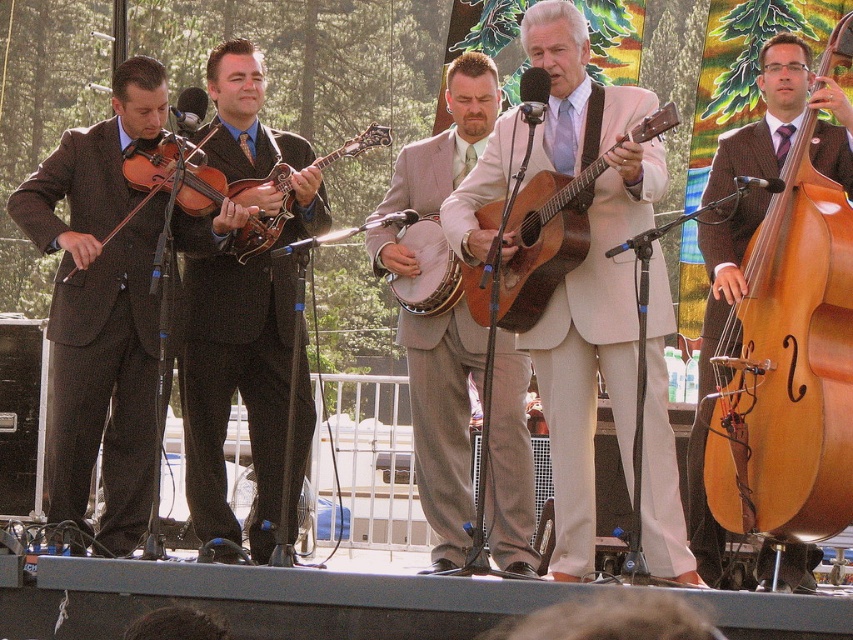
Question: Does light gray suit at center have a larger size compared to brown matte acoustic guitar at center?

Choices:
 (A) yes
 (B) no

Answer: (A)

Question: Is matte brown violin at left to the right of matte brown mandolin at center from the viewer's perspective?

Choices:
 (A) yes
 (B) no

Answer: (B)

Question: Which point is closer to the camera taking this photo?

Choices:
 (A) (476, 216)
 (B) (392, 138)
 (C) (451, 92)

Answer: (A)

Question: Which of these objects is positioned farthest from the matte brown violin at left?

Choices:
 (A) brown matte acoustic guitar at center
 (B) light beige suit at center

Answer: (B)

Question: Among these objects, which one is nearest to the camera?

Choices:
 (A) shiny brown mandolin at center
 (B) light beige suit at center
 (C) white fabric banjo at center

Answer: (B)

Question: Is the position of shiny brown mandolin at center more distant than that of light gray suit at center?

Choices:
 (A) no
 (B) yes

Answer: (A)